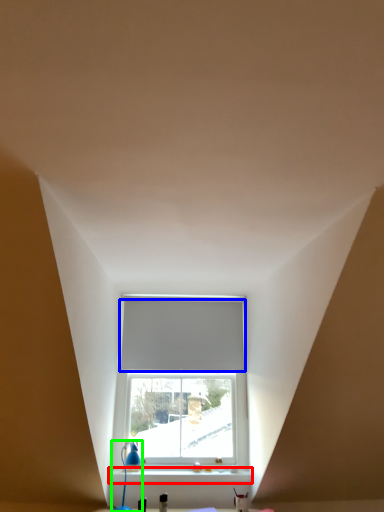
Question: Considering the real-world distances, which object is closest to window sill (highlighted by a red box)? blind (highlighted by a blue box) or table lamp (highlighted by a green box).

Choices:
 (A) blind
 (B) table lamp

Answer: (B)